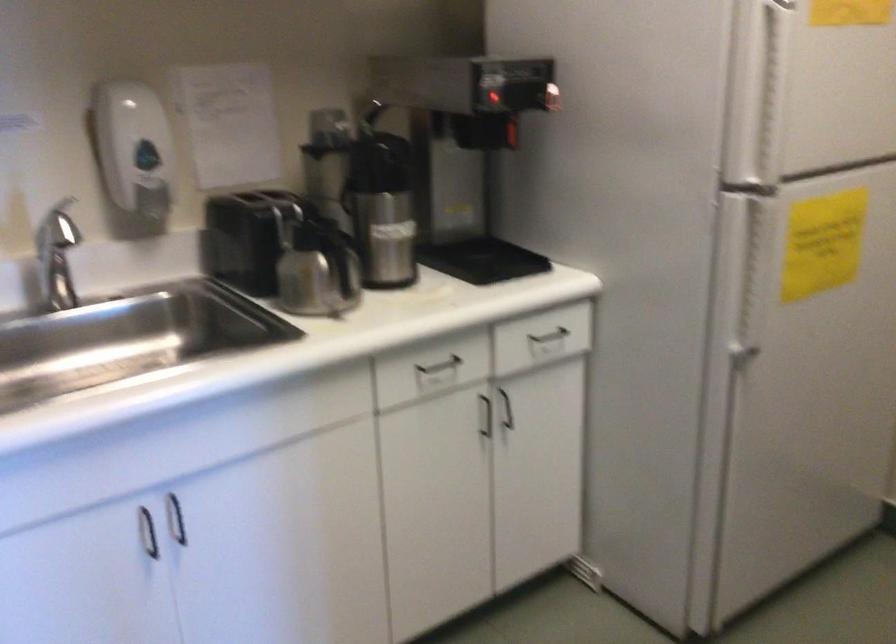
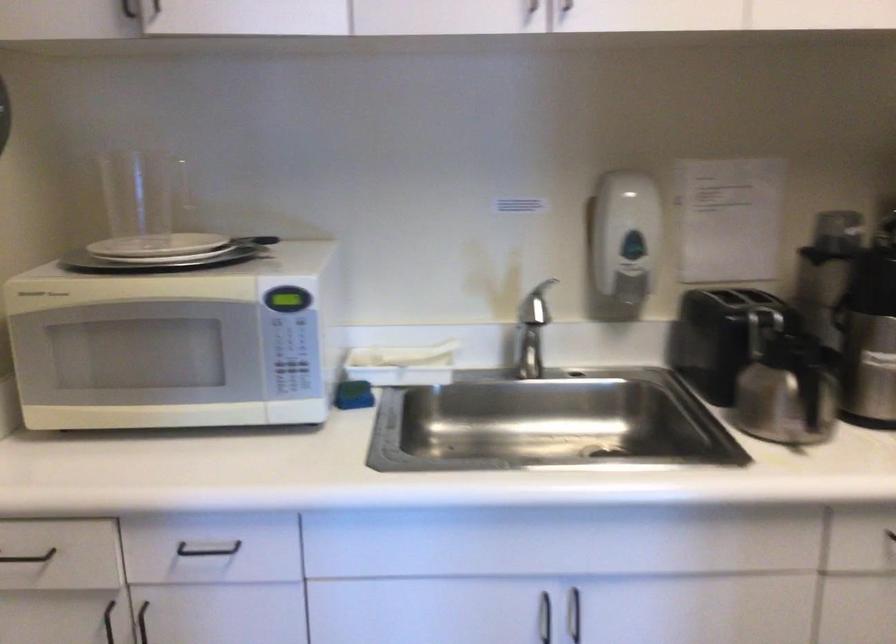
Find the pixel in the second image that matches (174,514) in the first image.

(573, 614)